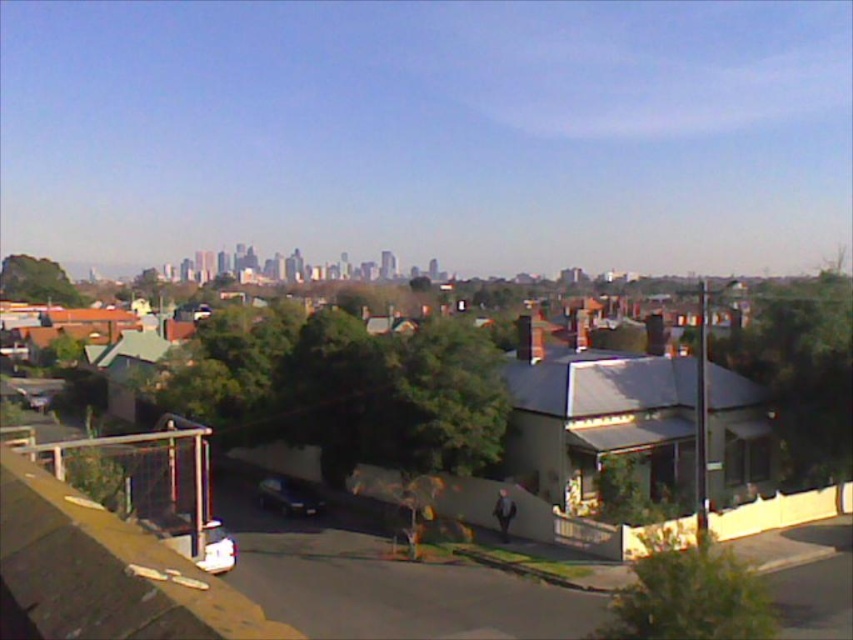
Question: Which of the following is the farthest from the observer?

Choices:
 (A) shiny black car at lower center
 (B) shiny black car at lower left

Answer: (B)

Question: Which point is farther to the camera?

Choices:
 (A) shiny black car at lower left
 (B) shiny black car at lower center

Answer: (A)

Question: Can you confirm if white matte car at lower center is thinner than shiny black car at lower left?

Choices:
 (A) yes
 (B) no

Answer: (A)

Question: Can you confirm if shiny black car at lower center is smaller than shiny black car at lower left?

Choices:
 (A) no
 (B) yes

Answer: (B)

Question: Does shiny black car at lower center have a lesser width compared to white matte car at lower center?

Choices:
 (A) no
 (B) yes

Answer: (B)

Question: Which point is farther from the camera taking this photo?

Choices:
 (A) (309, 515)
 (B) (45, 381)
 (C) (200, 538)

Answer: (B)